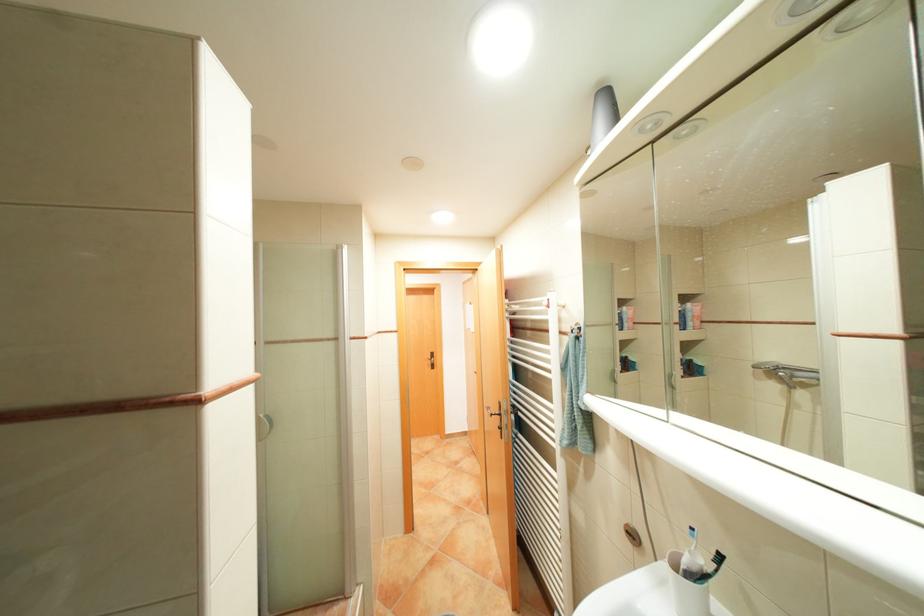
Which object does [602,115] point to?

It refers to a grey speaker.